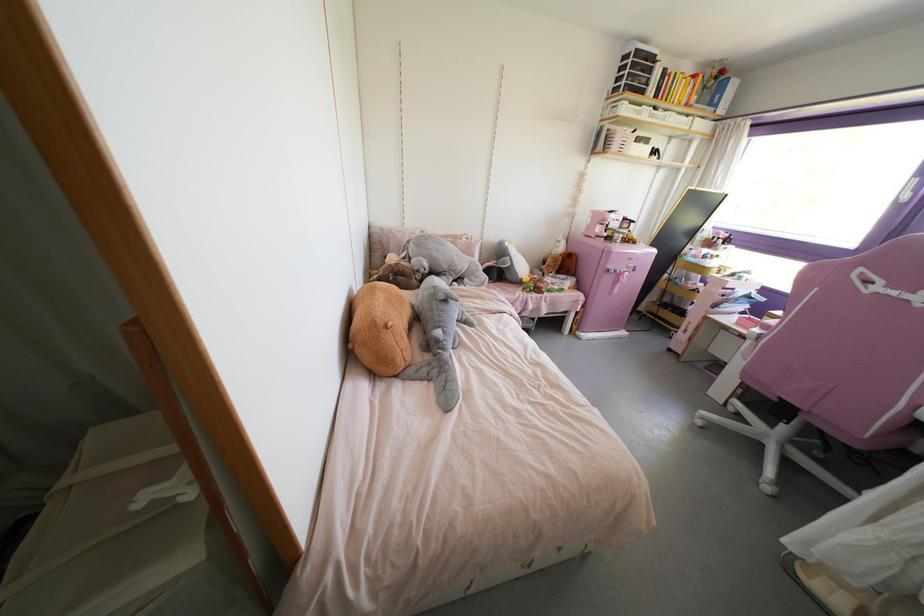
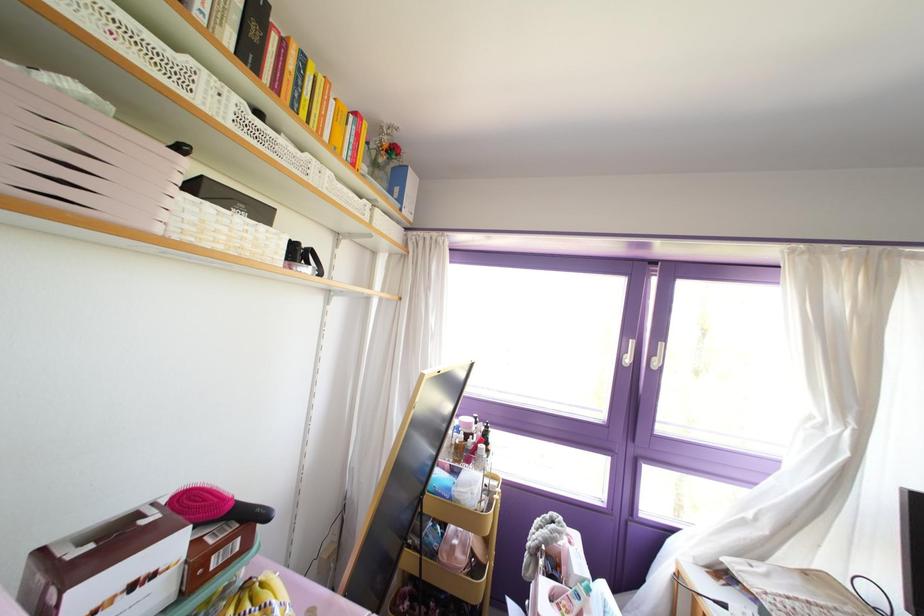
Locate, in the second image, the point that corresponds to point 703,87 in the first image.

(372, 163)